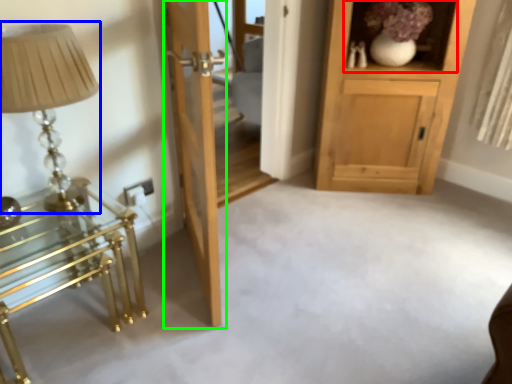
Question: Estimate the real-world distances between objects in this image. Which object is closer to shelf (highlighted by a red box), table lamp (highlighted by a blue box) or door (highlighted by a green box)?

Choices:
 (A) table lamp
 (B) door

Answer: (B)